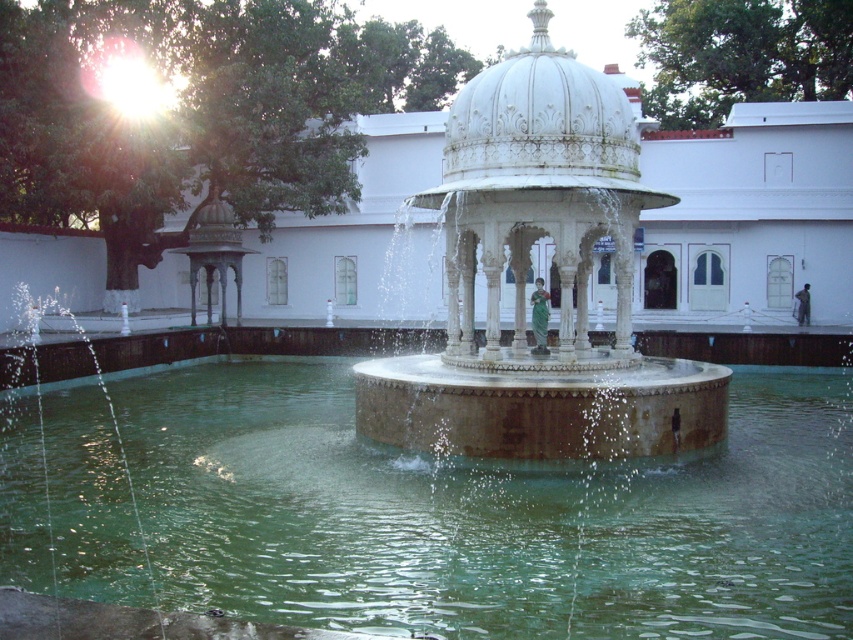
Which of these two, green marble gazebo at left or green fabric statue at center, stands shorter?

Standing shorter between the two is green fabric statue at center.

Does green marble gazebo at left lie behind green fabric statue at center?

Yes.

What do you see at coordinates (213, 252) in the screenshot? I see `green marble gazebo at left` at bounding box center [213, 252].

Image resolution: width=853 pixels, height=640 pixels. I want to click on green marble gazebo at left, so click(213, 252).

Measure the distance from white marble fountain at center to green fabric statue at center.

They are 9.91 feet apart.

Is point (608, 81) positioned after point (541, 328)?

No, it is not.

Locate an element on the screen. Image resolution: width=853 pixels, height=640 pixels. white marble fountain at center is located at coordinates (525, 284).

Can you confirm if white marble dome at center is positioned to the right of green fabric statue at center?

Incorrect, white marble dome at center is not on the right side of green fabric statue at center.

Which is below, white marble dome at center or green fabric statue at center?

Positioned lower is green fabric statue at center.

This screenshot has height=640, width=853. Identify the location of white marble dome at center. (540, 128).